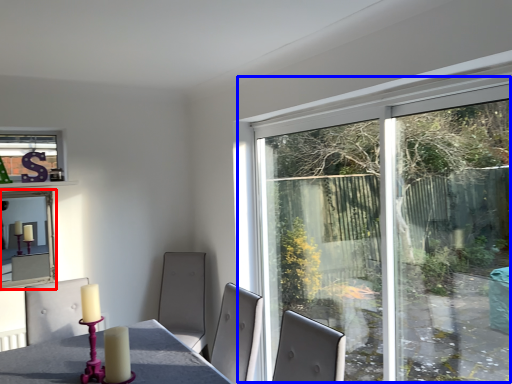
Question: Which object is further to the camera taking this photo, window screen (highlighted by a red box) or window (highlighted by a blue box)?

Choices:
 (A) window screen
 (B) window

Answer: (A)